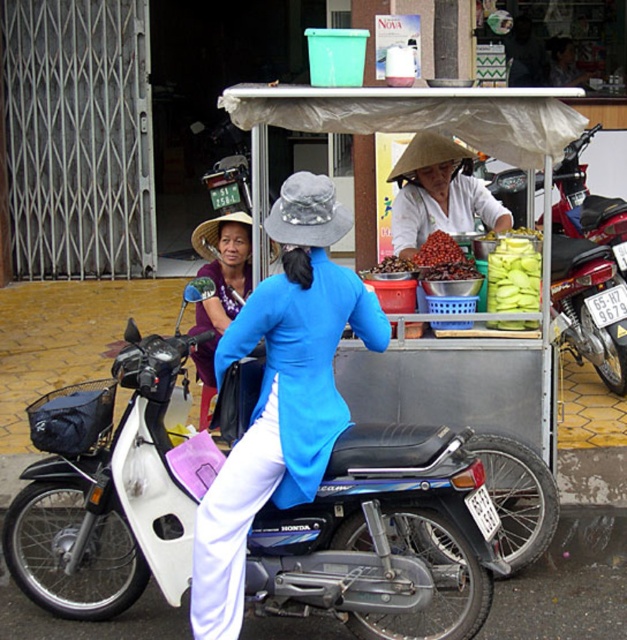
You are a delivery person who needs to load a package onto the metallic red motorcycle at center. The package is 1.2 meters tall. Can you place it on top of the motorcycle without bending it? Please consider the height of the matte purple dress at center as a reference point.

The metallic red motorcycle at center is much taller than the matte purple dress at center. Since the motorcycle is taller, the 1.2 meter package can likely be placed on top without bending, as the motorcycle provides sufficient height compared to the dress reference.

The scene shows a woman on a motorbike parked near a food stall. There is a point marked at coordinates (x=587, y=280). What object is located at that point?

The point at coordinates (x=587, y=280) marks the metallic red motorcycle at center.

You are standing in front of the motorbike with the basket and the food stall. There are two points marked on the scene. One is at point (551, 275) and the other is at point (211, 275). Which point is closer to you?

Point (211, 275) is closer to you because it is less further to the camera than point (551, 275).